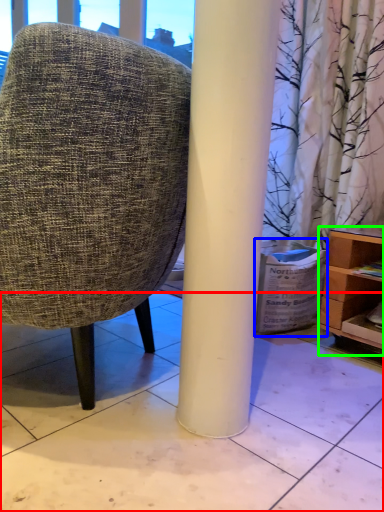
Question: Which object is positioned closest to tile (highlighted by a red box)? Select from cardboard box (highlighted by a blue box) and shelf (highlighted by a green box).

Choices:
 (A) cardboard box
 (B) shelf

Answer: (A)